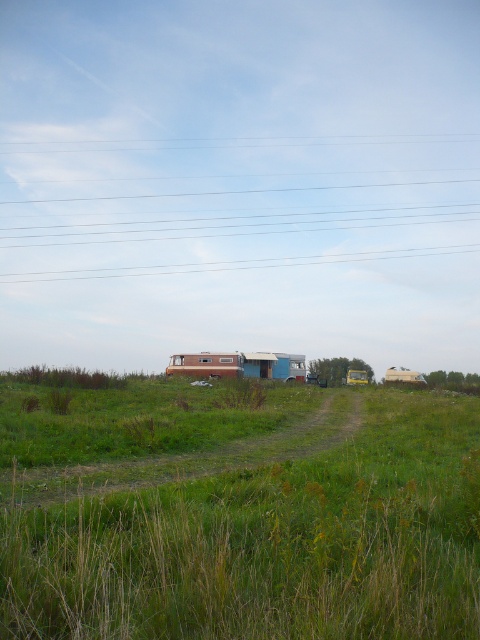
Does point (239, 624) come farther from viewer compared to point (222, 362)?

No, it is not.

Is green grassy at center bigger than brown wood cabin at center?

Yes, green grassy at center is bigger than brown wood cabin at center.

Does point (14, 621) come behind point (171, 368)?

That is False.

At what (x,y) coordinates should I click in order to perform the action: click on green grassy at center. Please return your answer as a coordinate pair (x, y). The height and width of the screenshot is (640, 480). Looking at the image, I should click on [268, 545].

Who is positioned more to the right, green grassy at center or wooden cabin at center?

green grassy at center

Between green grassy at center and wooden cabin at center, which one appears on the left side from the viewer's perspective?

From the viewer's perspective, wooden cabin at center appears more on the left side.

Who is more forward, [437,464] or [268,365]?

Point [437,464]

Locate an element on the screen. green grassy at center is located at coordinates [268, 545].

Looking at this image, is wooden cabin at center positioned behind brown wood cabin at center?

Yes.

You are a GUI agent. You are given a task and a screenshot of the screen. Output one action in this format:
    pyautogui.click(x=<x>, y=<y>)
    Task: Click on the wooden cabin at center
    This screenshot has width=480, height=640.
    Given the screenshot: What is the action you would take?
    pyautogui.click(x=239, y=364)